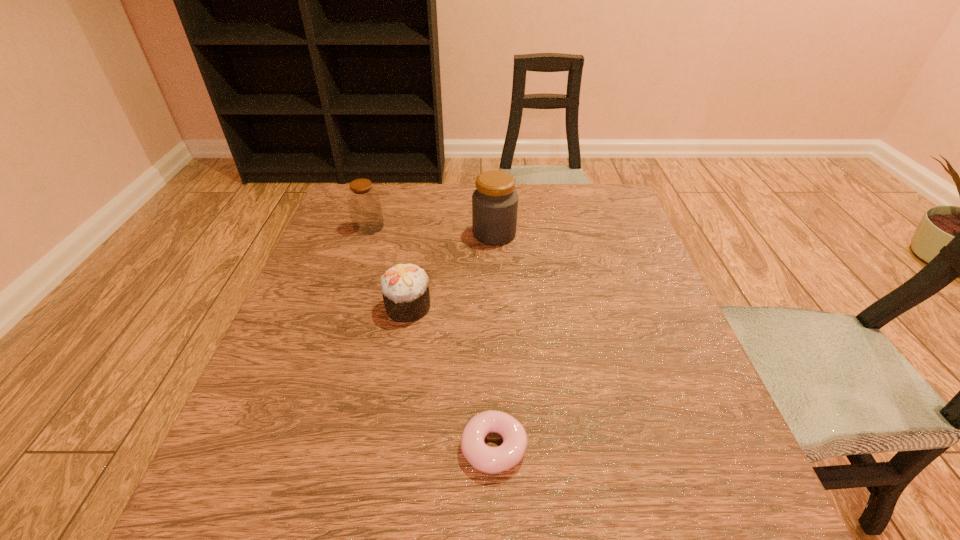
In order to click on vacant space located on the surface of the tallest object near the warning symbol in this screenshot , I will do `click(338, 234)`.

The width and height of the screenshot is (960, 540). I want to click on vacant space located on the front of the shorter jar, so click(x=337, y=322).

The image size is (960, 540). I want to click on free space located 0.100m on the left of the cupcake, so click(x=338, y=307).

This screenshot has width=960, height=540. Find the location of `free space located on the left of the doughnut`. free space located on the left of the doughnut is located at coordinates (405, 447).

Locate an element on the screen. This screenshot has height=540, width=960. object that is at the near edge is located at coordinates (490, 460).

You are a GUI agent. You are given a task and a screenshot of the screen. Output one action in this format:
    pyautogui.click(x=<x>, y=<y>)
    Task: Click on the object present at the left edge
    The width and height of the screenshot is (960, 540).
    Given the screenshot: What is the action you would take?
    pyautogui.click(x=363, y=200)

This screenshot has width=960, height=540. Find the location of `object present at the far left corner`. object present at the far left corner is located at coordinates (363, 200).

Image resolution: width=960 pixels, height=540 pixels. I want to click on vacant region at the far edge of the desktop, so click(551, 183).

Where is `free space at the near edge`? The width and height of the screenshot is (960, 540). free space at the near edge is located at coordinates (539, 495).

Where is `free space at the left edge`? free space at the left edge is located at coordinates (310, 264).